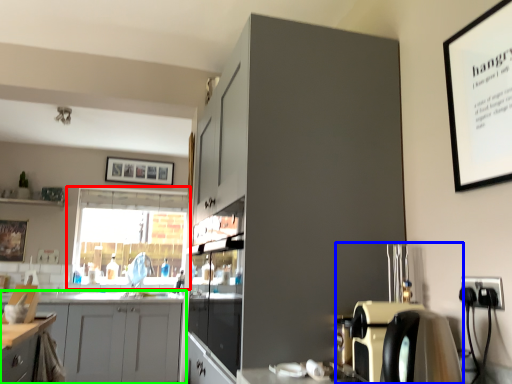
Question: Considering the real-world distances, which object is farthest from window (highlighted by a red box)? coffee machine (highlighted by a blue box) or cabinetry (highlighted by a green box)?

Choices:
 (A) coffee machine
 (B) cabinetry

Answer: (A)